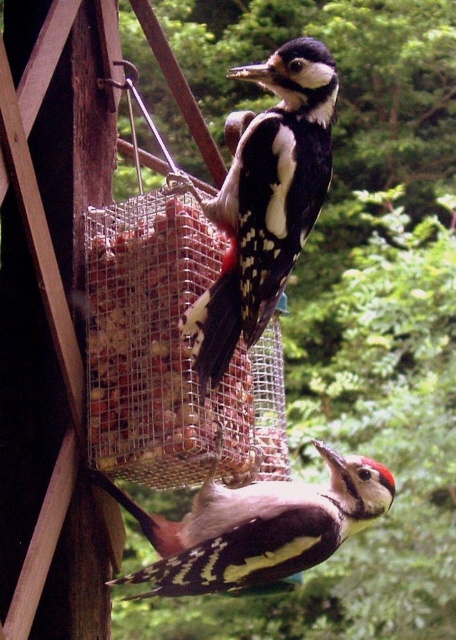
Can you confirm if smooth mesh container at center is positioned to the right of speckled brown woodpecker at center?

In fact, smooth mesh container at center is to the left of speckled brown woodpecker at center.

Can you confirm if smooth mesh container at center is positioned above speckled brown woodpecker at center?

Incorrect, smooth mesh container at center is not positioned above speckled brown woodpecker at center.

Who is more forward, (108, 243) or (310, 74)?

Point (310, 74)

This screenshot has height=640, width=456. Find the location of `smooth mesh container at center`. smooth mesh container at center is located at coordinates (156, 348).

Does smooth mesh container at center appear on the right side of speckled brown woodpecker at lower center?

Incorrect, smooth mesh container at center is not on the right side of speckled brown woodpecker at lower center.

Can you confirm if smooth mesh container at center is positioned above speckled brown woodpecker at lower center?

Yes.

Does point (124, 365) lie behind point (124, 577)?

That is True.

This screenshot has width=456, height=640. I want to click on smooth mesh container at center, so click(156, 348).

Is speckled brown woodpecker at center thinner than speckled brown woodpecker at lower center?

Yes.

Who is more distant from viewer, (286, 113) or (149, 515)?

Positioned behind is point (149, 515).

Is point (258, 228) behind point (169, 584)?

No, it is not.

Locate an element on the screen. The image size is (456, 640). speckled brown woodpecker at center is located at coordinates (265, 202).